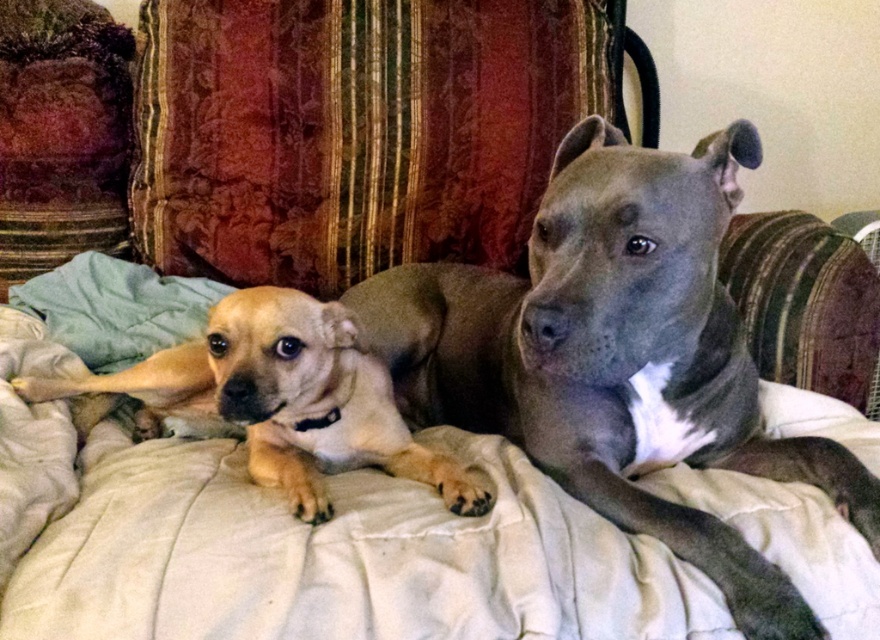
You are a pet sitter who needs to ensure all pets are safe. You see a smooth brown dog at center and a velvet fabric couch at center. Which pet should you be more cautious about due to its size?

The smooth brown dog at center is larger in size than the velvet fabric couch at center, so you should be more cautious about the smooth brown dog at center because it is bigger and may require more space and attention to ensure safety.

You are a dog owner trying to decide where to place a new dog bed. You observe the light brown fur at center and the velvet fabric couch at center in the image. Which object is shorter in height?

The light brown fur at center has a lesser height compared to the velvet fabric couch at center, so the light brown fur at center is shorter in height.

You are standing in the room where the two dogs are resting. You want to place a small decorative item exactly at the point with coordinates point [352,131]. Where should you place it?

The point [352,131] is located on the velvet cushion at upper center, so you should place the small decorative item there.